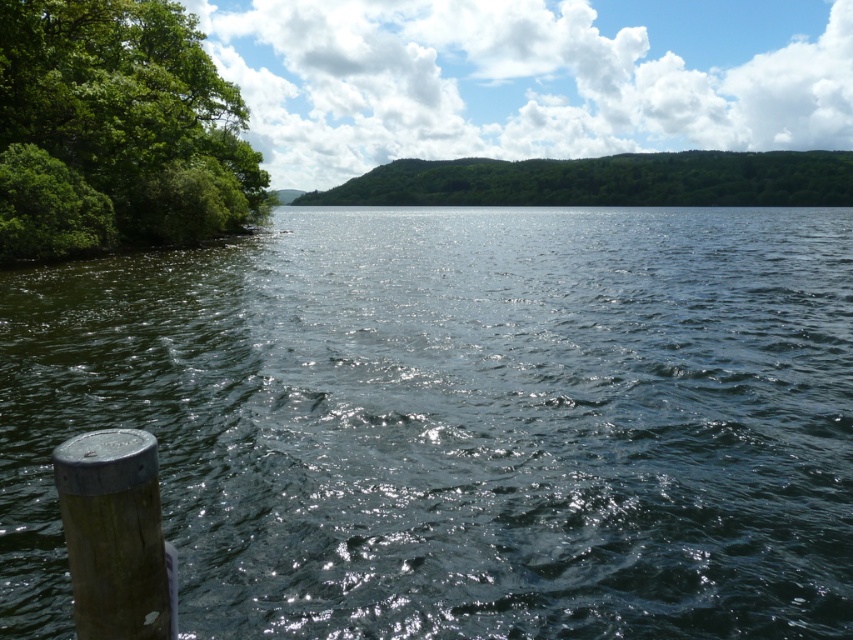
Question: Can you confirm if dark green water at center is smaller than green leafy forest at upper center?

Choices:
 (A) yes
 (B) no

Answer: (A)

Question: Is green leafy bush at left above green leafy forest at upper center?

Choices:
 (A) no
 (B) yes

Answer: (A)

Question: Among these points, which one is farthest from the camera?

Choices:
 (A) (363, 458)
 (B) (108, 579)

Answer: (A)

Question: Which point appears closest to the camera in this image?

Choices:
 (A) (814, 586)
 (B) (76, 460)

Answer: (B)

Question: Is green leafy bush at left positioned behind wooden post at lower left?

Choices:
 (A) no
 (B) yes

Answer: (B)

Question: Which of these objects is positioned closest to the green leafy forest at upper center?

Choices:
 (A) dark green water at center
 (B) green leafy bush at left
 (C) wooden post at lower left

Answer: (A)